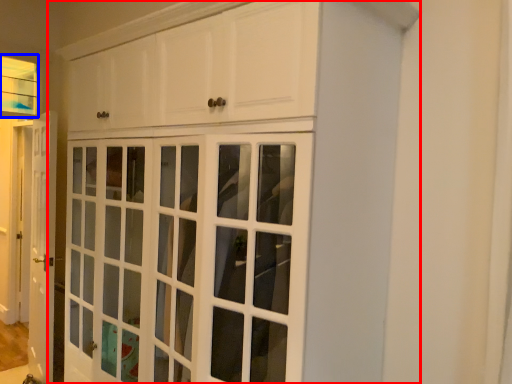
Question: Which point is closer to the camera, cupboard (highlighted by a red box) or window (highlighted by a blue box)?

Choices:
 (A) cupboard
 (B) window

Answer: (A)